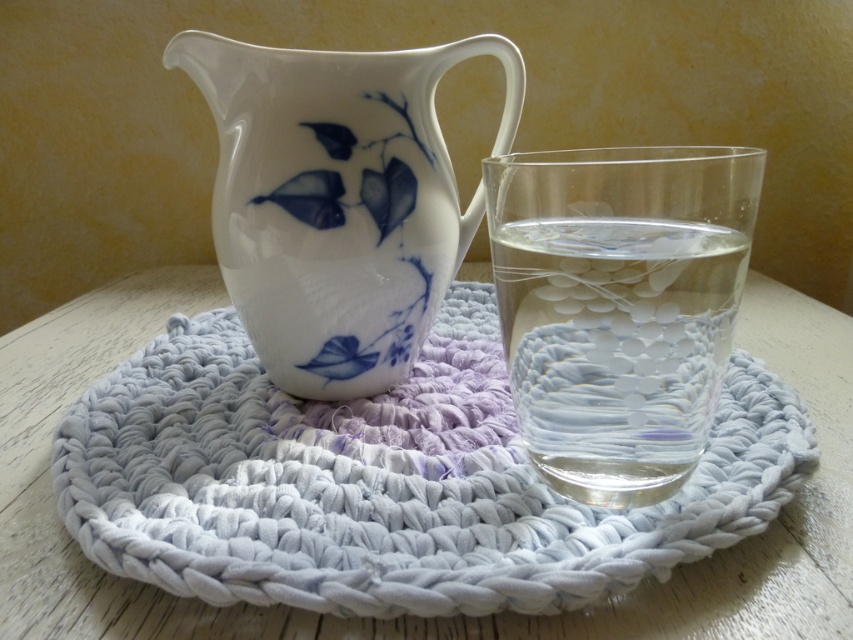
How much distance is there between white porcelain jug at center and transparent glass water at center?

white porcelain jug at center is 15.43 centimeters away from transparent glass water at center.

Which is more to the right, white porcelain jug at center or transparent glass water at center?

Positioned to the right is transparent glass water at center.

Between point (288, 336) and point (537, 372), which one is positioned behind?

Positioned behind is point (288, 336).

Find the location of a particular element. The image size is (853, 640). white porcelain jug at center is located at coordinates (335, 200).

Does point (801, 573) lie behind point (329, 168)?

No, it is not.

Can you confirm if white knitted coaster at center is smaller than white porcelain jug at center?

Actually, white knitted coaster at center might be larger than white porcelain jug at center.

Between point (62, 372) and point (248, 294), which one is positioned behind?

Positioned behind is point (62, 372).

Identify the location of white knitted coaster at center. (415, 618).

Is the position of white knitted coaster at center less distant than that of transparent glass water at center?

Yes, white knitted coaster at center is in front of transparent glass water at center.

Which is in front, point (392, 621) or point (608, 461)?

Point (392, 621) is in front.

This screenshot has width=853, height=640. What are the coordinates of `white knitted coaster at center` in the screenshot? It's located at (415, 618).